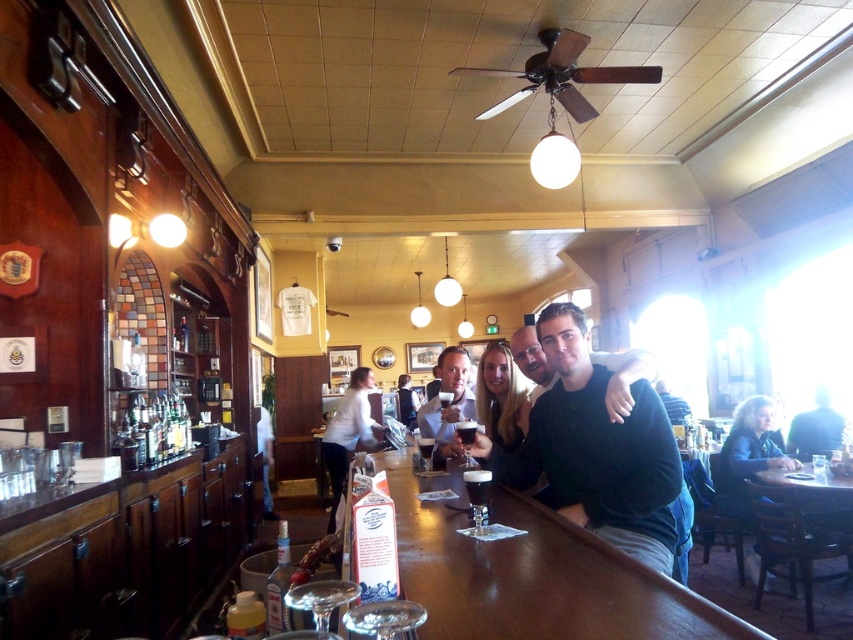
Between transparent glass at bar front and clear glass wine glass at bar center, which one is positioned lower?

transparent glass at bar front is lower down.

Is point (474, 499) closer to camera compared to point (440, 396)?

Yes.

Who is more forward, (463,477) or (440,410)?

Point (463,477) is more forward.

The width and height of the screenshot is (853, 640). I want to click on transparent glass at bar front, so click(477, 497).

Looking at this image, which is above, dark blue shirt at right or clear glass wine glass at bar counter?

clear glass wine glass at bar counter is above.

Between point (821, 435) and point (422, 456), which one is positioned behind?

Point (821, 435)

Between point (822, 406) and point (433, 438), which one is positioned behind?

Point (822, 406)

Locate an element on the screen. This screenshot has height=640, width=853. dark blue shirt at right is located at coordinates (815, 428).

Does matte black shirt at center have a lesser width compared to clear glass wine glass at bar?

In fact, matte black shirt at center might be wider than clear glass wine glass at bar.

Where is `matte black shirt at center`? The width and height of the screenshot is (853, 640). matte black shirt at center is located at coordinates (448, 403).